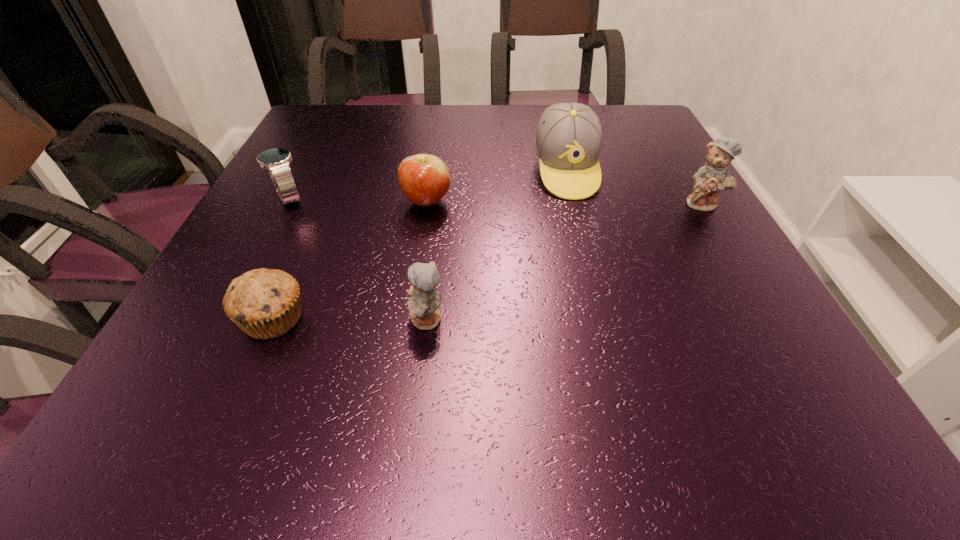
The image size is (960, 540). In order to click on unoccupied area between the nearer teddy bear and the muffin in this screenshot , I will do `click(349, 319)`.

The width and height of the screenshot is (960, 540). Identify the location of empty space between the second object from right to left and the left teddy bear. (496, 245).

What are the coordinates of `vacant space that's between the muffin and the baseball cap` in the screenshot? It's located at (420, 244).

What are the coordinates of `unoccupied area between the muffin and the left teddy bear` in the screenshot? It's located at (349, 319).

Locate an element on the screen. The image size is (960, 540). free space between the left teddy bear and the muffin is located at coordinates (349, 319).

Locate an element on the screen. free space between the watch and the apple is located at coordinates (358, 200).

I want to click on vacant area that lies between the apple and the second object from right to left, so click(496, 186).

Locate an element on the screen. empty location between the apple and the left teddy bear is located at coordinates (426, 261).

In order to click on free space between the muffin and the shorter teddy bear in this screenshot , I will do `click(349, 319)`.

Find the location of a particular element. The height and width of the screenshot is (540, 960). the fourth closest object to the baseball cap is located at coordinates (265, 303).